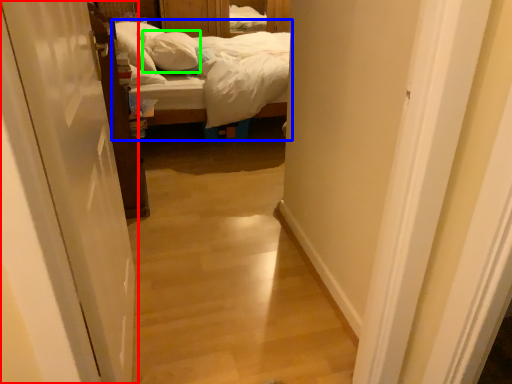
Question: Considering the real-world distances, which object is farthest from door (highlighted by a red box)? bed (highlighted by a blue box) or pillow (highlighted by a green box)?

Choices:
 (A) bed
 (B) pillow

Answer: (B)